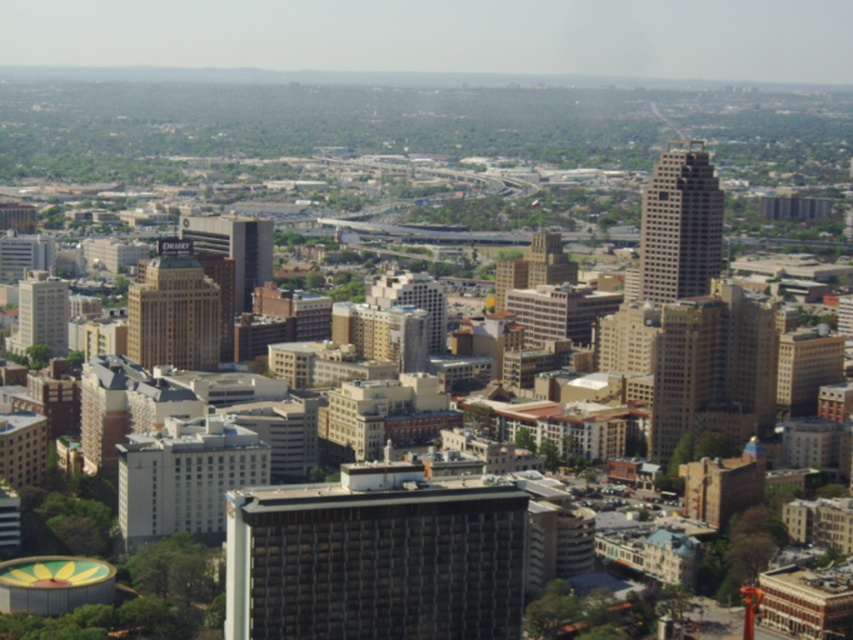
You are a drone operator planning to fly a drone from the point at coordinates (131, 342) to another point in the city. The maximum flight distance your drone can handle is 600 meters. Based on the scene description, can your drone safely complete this flight without exceeding its range?

The two points are 667.85 meters apart, which exceeds the drone flight range of 600 meters. Therefore, the drone cannot safely complete the flight without exceeding its range.

You are a city planner reviewing this aerial view. You need to determine the spatial relationship between the dark gray concrete building at center and the matte white building at center. Which one is positioned lower in the image?

The dark gray concrete building at center is positioned lower than the matte white building at center according to the description.